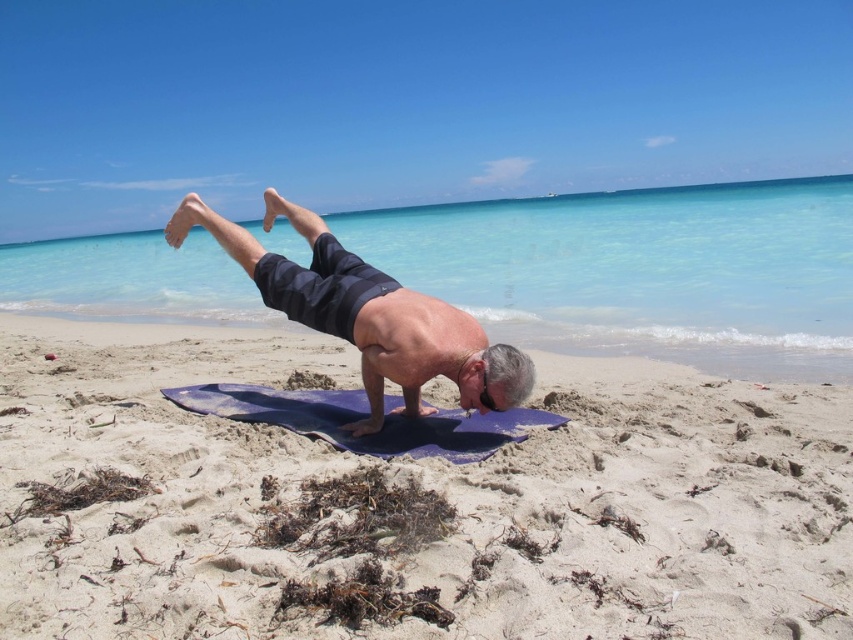
Between matte black yoga mat at center and purple rubber mat at center, which one is positioned higher?

matte black yoga mat at center is higher up.

In order to click on matte black yoga mat at center in this screenshot , I will do 367,314.

Which is in front, point (422, 380) or point (490, 428)?

Point (422, 380) is more forward.

At what (x,y) coordinates should I click in order to perform the action: click on matte black yoga mat at center. Please return your answer as a coordinate pair (x, y). The width and height of the screenshot is (853, 640). Looking at the image, I should click on (367, 314).

Can you confirm if white sandy beach at center is taller than matte black yoga mat at center?

In fact, white sandy beach at center may be shorter than matte black yoga mat at center.

Does white sandy beach at center appear under matte black yoga mat at center?

Correct, white sandy beach at center is located below matte black yoga mat at center.

Is point (676, 477) less distant than point (172, 214)?

Yes, it is in front of point (172, 214).

Identify the location of white sandy beach at center. (421, 488).

Is white sandy beach at center behind purple rubber mat at center?

No, it is in front of purple rubber mat at center.

Locate an element on the screen. This screenshot has height=640, width=853. white sandy beach at center is located at coordinates (421, 488).